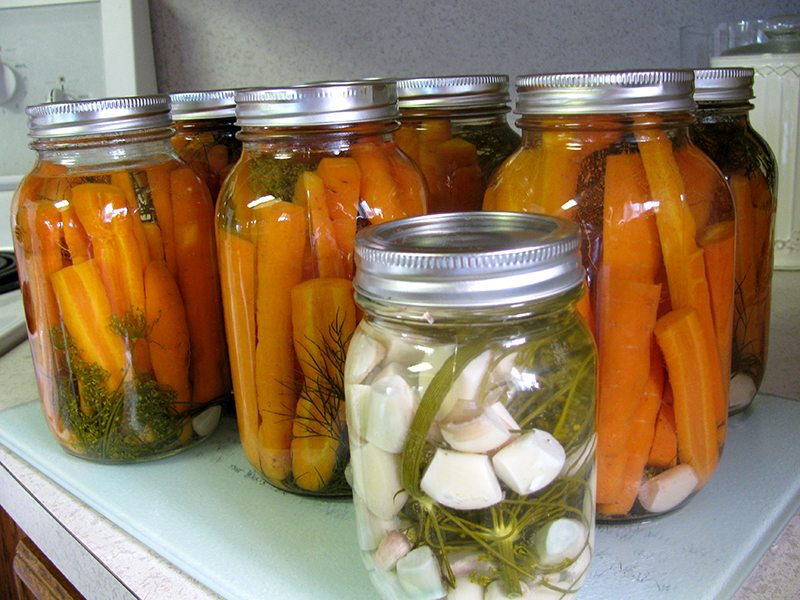
This screenshot has width=800, height=600. I want to click on counter, so click(285, 557).